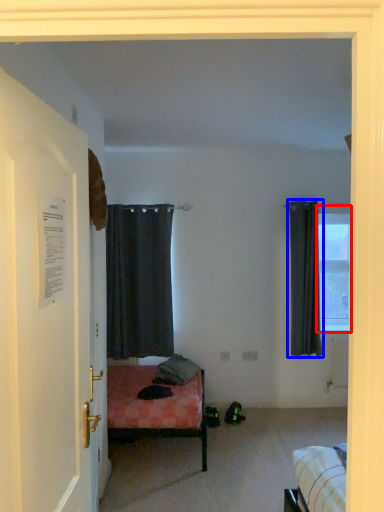
Question: Which of the following is the farthest to the observer, window (highlighted by a red box) or curtain (highlighted by a blue box)?

Choices:
 (A) window
 (B) curtain

Answer: (A)